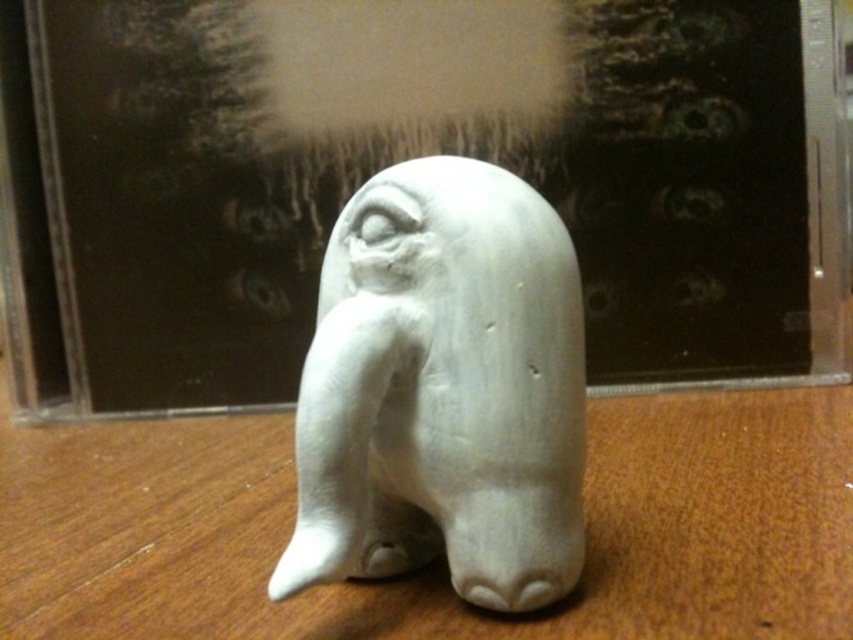
Where is the wooden table at center located in the image?

The wooden table at center is located at point [440,560] in the image.

You are arranging items on a table and see the wooden table at center and the white matte elephant at center. Which object is located to the left of the other?

The wooden table at center is positioned on the left side of white matte elephant at center.